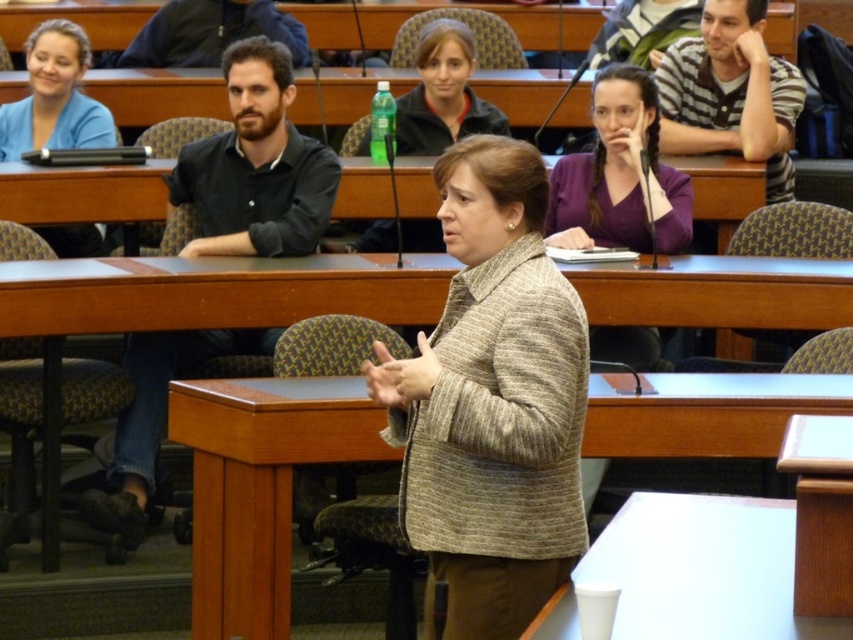
You are a student in the classroom and want to know which object is positioned more to the right between the striped cotton shirt at upper right and the dark blue jacket at upper left. Can you determine this based on their positions?

The striped cotton shirt at upper right is positioned more to the right than the dark blue jacket at upper left.

Consider the image. You are a student in the classroom and need to borrow a jacket. Both the purple matte jacket at upper right and the dark blue jacket at upper left are available. Which jacket can you take if you prefer a larger size?

The purple matte jacket at upper right is bigger than the dark blue jacket at upper left, so you should take the purple matte jacket at upper right.